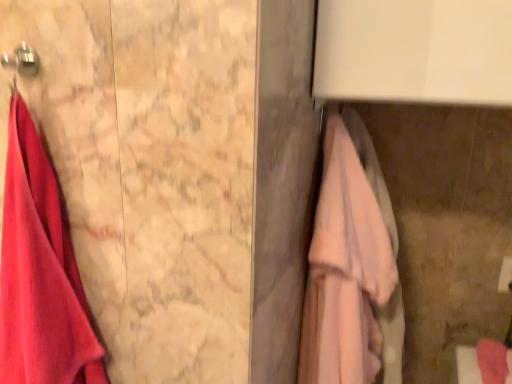
Question: Can pink fabric towel at right, the second towel viewed from the left, be found inside metallic hook at upper left?

Choices:
 (A) yes
 (B) no

Answer: (B)

Question: Is pink fabric towel at right, which is counted as the first towel, starting from the right, at the back of metallic hook at upper left?

Choices:
 (A) yes
 (B) no

Answer: (B)

Question: Is metallic hook at upper left further to camera compared to pink fabric towel at right, the second towel viewed from the left?

Choices:
 (A) no
 (B) yes

Answer: (A)

Question: Considering the relative sizes of metallic hook at upper left and pink fabric towel at right, which is counted as the first towel, starting from the right, in the image provided, is metallic hook at upper left smaller than pink fabric towel at right, which is counted as the first towel, starting from the right,?

Choices:
 (A) yes
 (B) no

Answer: (A)

Question: Considering the relative sizes of metallic hook at upper left and pink fabric towel at right, the second towel viewed from the left, in the image provided, is metallic hook at upper left thinner than pink fabric towel at right, the second towel viewed from the left,?

Choices:
 (A) yes
 (B) no

Answer: (A)

Question: From a real-world perspective, relative to matte pink towel at left, the second towel in the right-to-left sequence, is pink fabric towel at right, the second towel viewed from the left, vertically above or below?

Choices:
 (A) below
 (B) above

Answer: (A)

Question: Is pink fabric towel at right, the second towel viewed from the left, taller or shorter than matte pink towel at left, the second towel in the right-to-left sequence?

Choices:
 (A) short
 (B) tall

Answer: (B)

Question: Which is correct: pink fabric towel at right, which is counted as the first towel, starting from the right, is inside matte pink towel at left, the second towel in the right-to-left sequence, or outside of it?

Choices:
 (A) inside
 (B) outside

Answer: (B)

Question: Is point (393, 324) closer or farther from the camera than point (75, 301)?

Choices:
 (A) farther
 (B) closer

Answer: (A)

Question: Visually, is metallic hook at upper left positioned to the left or to the right of matte pink towel at left, the first towel viewed from the left?

Choices:
 (A) left
 (B) right

Answer: (B)

Question: From their relative heights in the image, would you say metallic hook at upper left is taller or shorter than matte pink towel at left, the second towel in the right-to-left sequence?

Choices:
 (A) tall
 (B) short

Answer: (B)

Question: Based on their sizes in the image, would you say metallic hook at upper left is bigger or smaller than matte pink towel at left, the second towel in the right-to-left sequence?

Choices:
 (A) big
 (B) small

Answer: (B)

Question: From a real-world perspective, is metallic hook at upper left above or below matte pink towel at left, the first towel viewed from the left?

Choices:
 (A) above
 (B) below

Answer: (A)

Question: Looking at the image, does metallic hook at upper left seem bigger or smaller compared to pink fabric towel bar at right?

Choices:
 (A) small
 (B) big

Answer: (A)

Question: From their relative heights in the image, would you say metallic hook at upper left is taller or shorter than pink fabric towel bar at right?

Choices:
 (A) short
 (B) tall

Answer: (A)